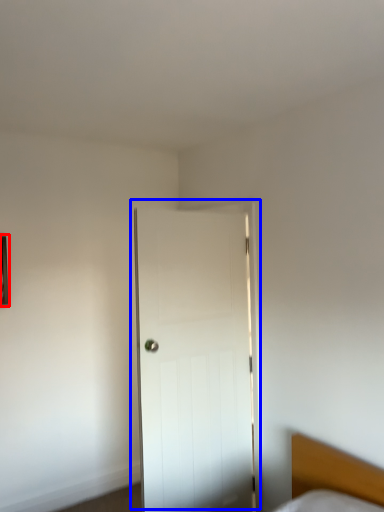
Question: Which of the following is the farthest to the observer, picture frame (highlighted by a red box) or door (highlighted by a blue box)?

Choices:
 (A) picture frame
 (B) door

Answer: (A)